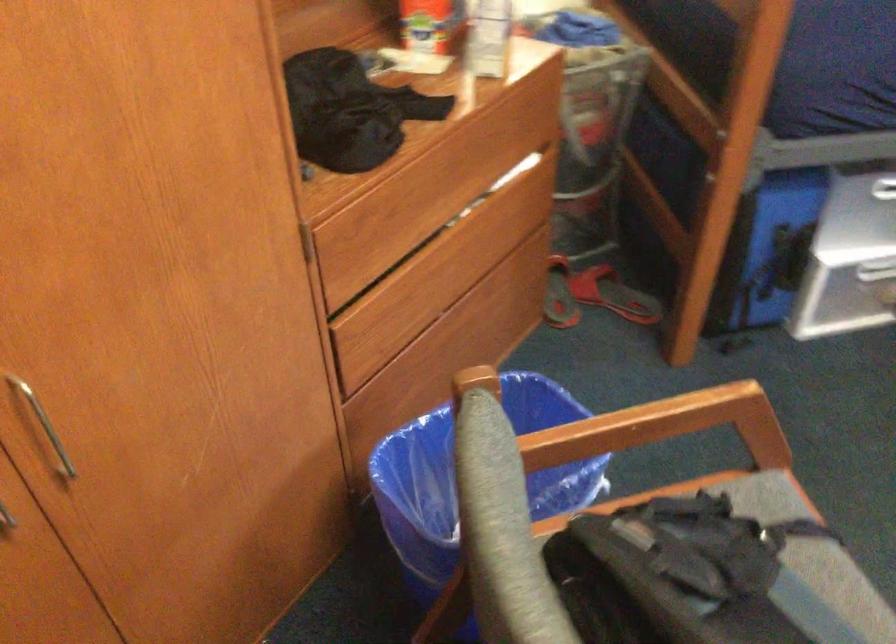
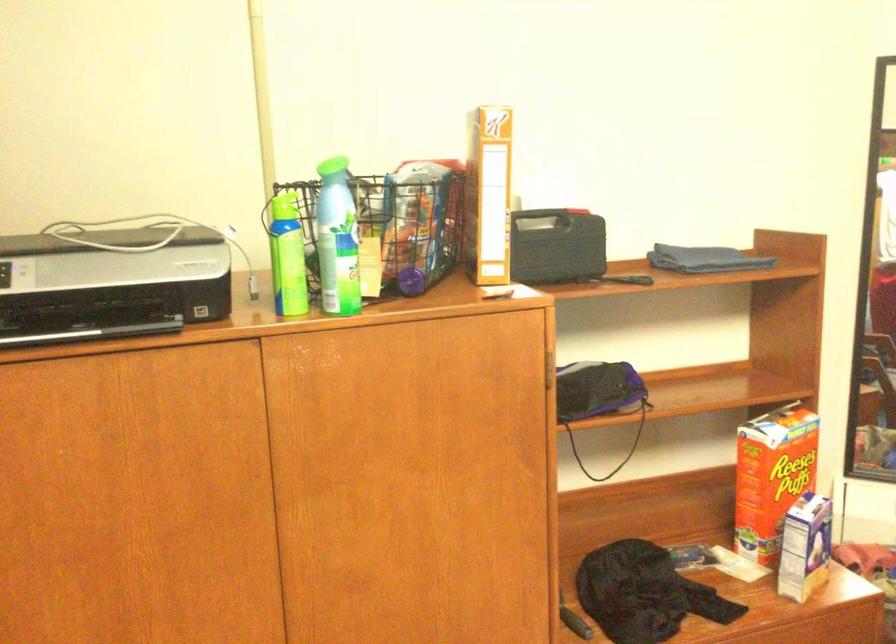
How did the camera likely rotate?

The camera rotated toward left-up.